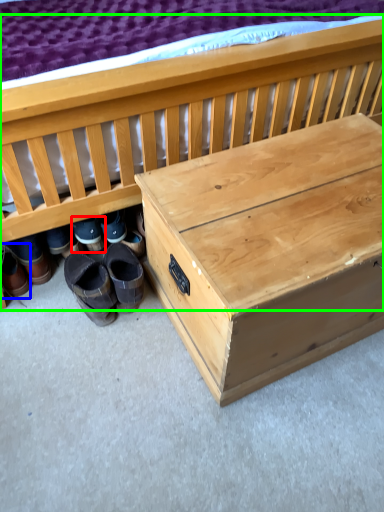
Question: Which is farther away from footwear (highlighted by a red box)? footwear (highlighted by a blue box) or furniture (highlighted by a green box)?

Choices:
 (A) footwear
 (B) furniture

Answer: (B)